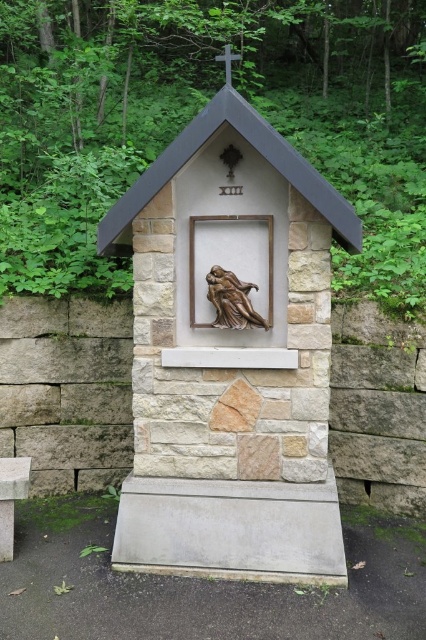
Is bronze statue at center smaller than bronze sculpture at center?

No, bronze statue at center is not smaller than bronze sculpture at center.

I want to click on bronze statue at center, so click(230, 356).

Does point (170, 156) come farther from viewer compared to point (232, 276)?

No, it is not.

Locate an element on the screen. Image resolution: width=426 pixels, height=640 pixels. bronze statue at center is located at coordinates (230, 356).